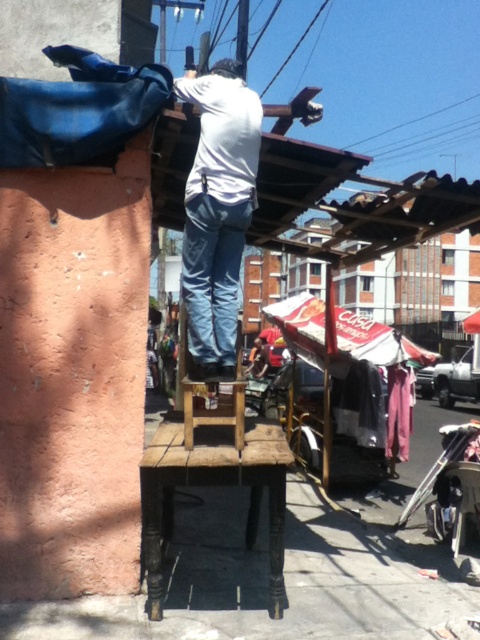
Question: Which point appears closest to the camera in this image?

Choices:
 (A) (278, 563)
 (B) (230, 276)

Answer: (A)

Question: Which of the following is the closest to the observer?

Choices:
 (A) (192, 182)
 (B) (157, 467)

Answer: (B)

Question: Is white matte shirt at center thinner than wooden stool at center?

Choices:
 (A) yes
 (B) no

Answer: (A)

Question: Considering the relative positions of white matte shirt at center and wooden stool at center in the image provided, where is white matte shirt at center located with respect to wooden stool at center?

Choices:
 (A) right
 (B) left

Answer: (A)

Question: In this image, where is white matte shirt at center located relative to wooden stool at center?

Choices:
 (A) right
 (B) left

Answer: (A)